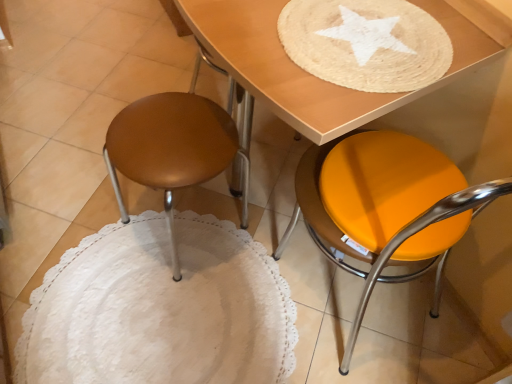
The image size is (512, 384). In order to click on unoccupied area in front of matte brown stool at left in this screenshot , I will do `click(175, 325)`.